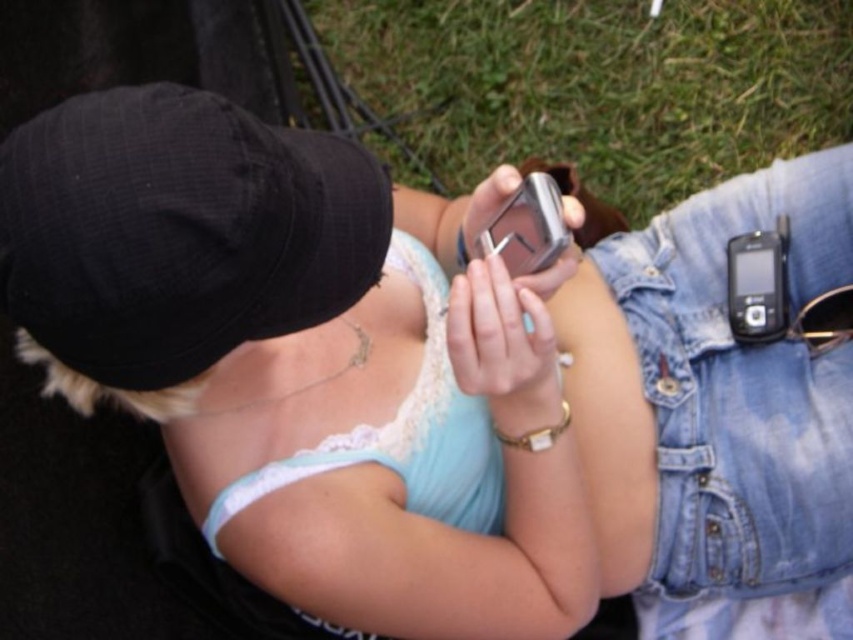
Between denim at right and white lace bikini top at center, which one has more height?

Standing taller between the two is denim at right.

Is denim at right thinner than white lace bikini top at center?

No.

Is point (793, 621) less distant than point (490, 532)?

No, it is not.

Image resolution: width=853 pixels, height=640 pixels. What are the coordinates of `denim at right` in the screenshot? It's located at (743, 412).

Is white lace bikini top at center shorter than silver metallic phone at center?

No.

Which is in front, point (419, 241) or point (561, 218)?

Point (561, 218)

Does point (482, 449) come behind point (554, 252)?

Yes, it is behind point (554, 252).

Identify the location of white lace bikini top at center. (404, 432).

Can you confirm if black fabric baseball cap at upper left is positioned to the right of denim at right?

No, black fabric baseball cap at upper left is not to the right of denim at right.

Is the position of black fabric baseball cap at upper left less distant than that of denim at right?

That is True.

Is point (271, 316) more distant than point (757, 586)?

That is False.

Find the location of a particular element. black fabric baseball cap at upper left is located at coordinates (178, 230).